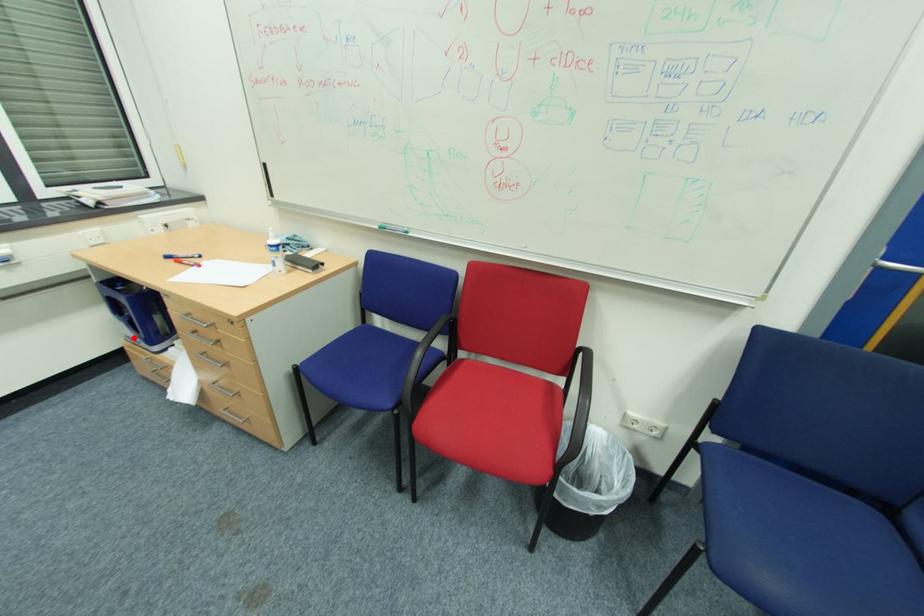
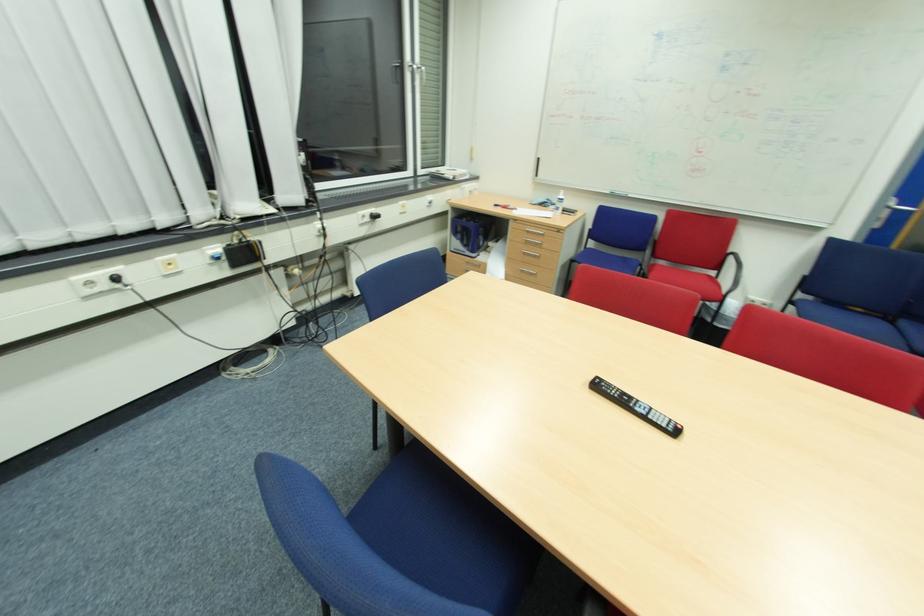
Question: I am providing you with two images of the same scene from different viewpoints. A red point is shown in image1. For the corresponding object point in image2, is it positioned nearer or farther from the camera?

Choices:
 (A) Nearer
 (B) Farther

Answer: (B)